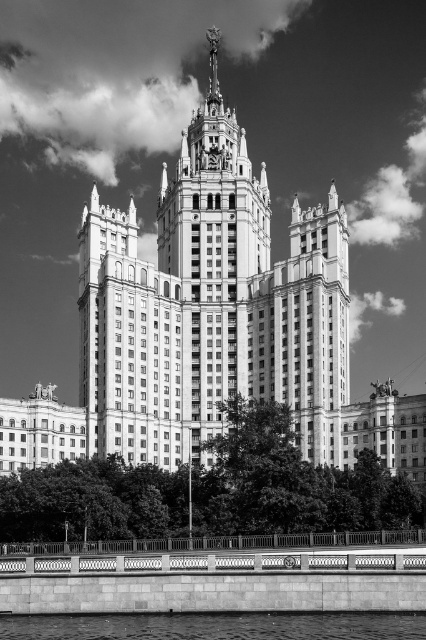
Question: Is smooth concrete tower at center below smooth concrete river at lower center?

Choices:
 (A) no
 (B) yes

Answer: (A)

Question: Based on their relative distances, which object is nearer to the smooth concrete river at lower center?

Choices:
 (A) smooth concrete tower at center
 (B) white stone tower at center

Answer: (A)

Question: Is smooth concrete tower at center positioned in front of smooth concrete river at lower center?

Choices:
 (A) yes
 (B) no

Answer: (B)

Question: Among these points, which one is farthest from the camera?

Choices:
 (A) (9, 637)
 (B) (158, 292)

Answer: (B)

Question: Can you confirm if white stone tower at center is bigger than smooth concrete river at lower center?

Choices:
 (A) yes
 (B) no

Answer: (A)

Question: Which point is farther to the camera?

Choices:
 (A) smooth concrete river at lower center
 (B) smooth concrete tower at center

Answer: (B)